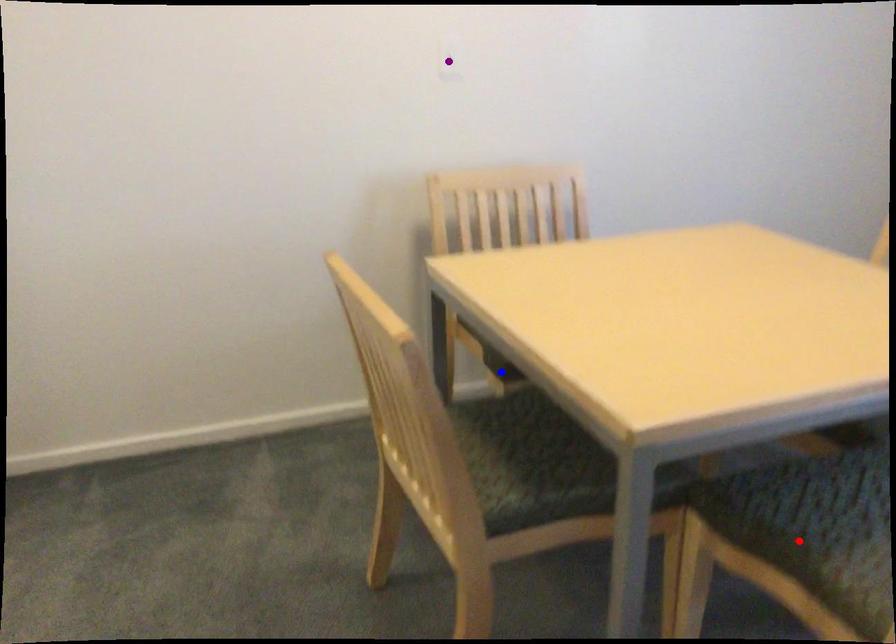
Looking at this image, order these from nearest to farthest:
blue point, red point, purple point

red point → blue point → purple point